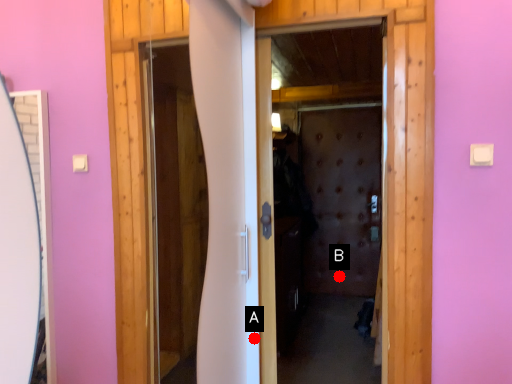
Question: Two points are circled on the image, labeled by A and B beside each circle. Which point is closer to the camera?

Choices:
 (A) A is closer
 (B) B is closer

Answer: (A)